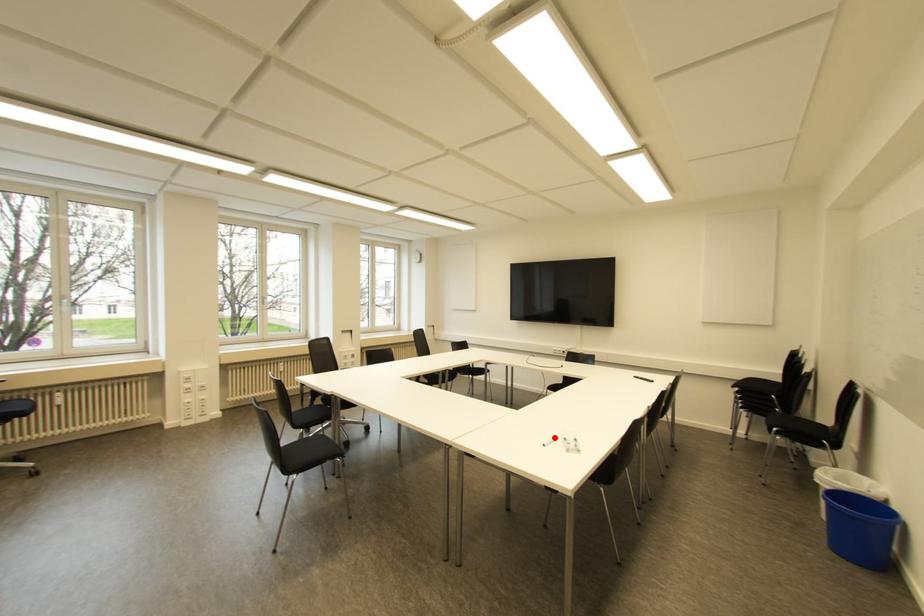
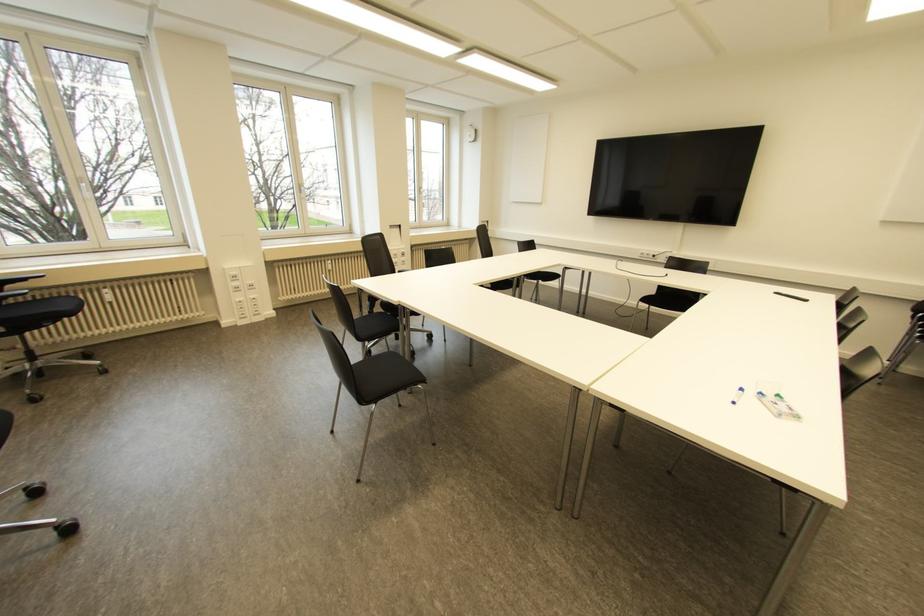
Question: I am providing you with two images of the same scene from different viewpoints. A red point is shown in image1. For the corresponding object point in image2, is it positioned nearer or farther from the camera?

Choices:
 (A) Nearer
 (B) Farther

Answer: (B)